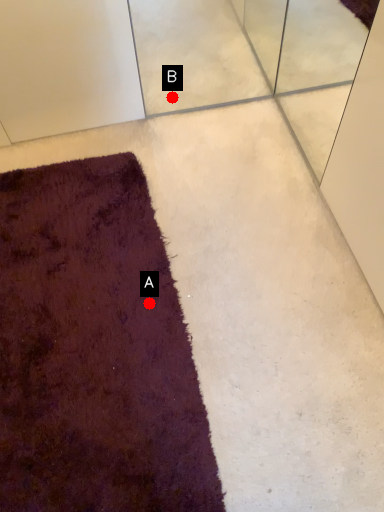
Question: Two points are circled on the image, labeled by A and B beside each circle. Which of the following is the closest to the observer?

Choices:
 (A) A is closer
 (B) B is closer

Answer: (A)